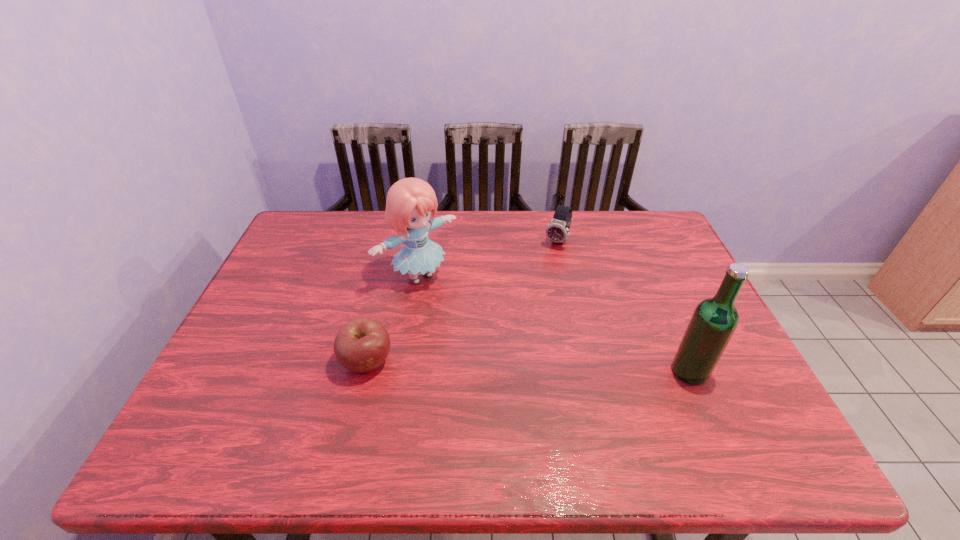
At what (x,y) coordinates should I click in order to perform the action: click on free location located 0.140m on the front-facing side of the second farthest object. Please return your answer as a coordinate pair (x, y). Looking at the image, I should click on (472, 321).

Find the location of `vacant area situated on the front-facing side of the second farthest object`. vacant area situated on the front-facing side of the second farthest object is located at coordinates (543, 383).

Find the location of a particular element. Image resolution: width=960 pixels, height=540 pixels. free spot located 0.170m on the front-facing side of the second farthest object is located at coordinates (480, 327).

This screenshot has height=540, width=960. I want to click on object located at the far edge, so click(x=557, y=231).

This screenshot has width=960, height=540. I want to click on object situated at the near edge, so click(714, 321).

Where is `object that is at the right edge`? The height and width of the screenshot is (540, 960). object that is at the right edge is located at coordinates (714, 321).

You are a GUI agent. You are given a task and a screenshot of the screen. Output one action in this format:
    pyautogui.click(x=<x>, y=<y>)
    Task: Click on the object that is at the near right corner
    This screenshot has height=540, width=960.
    Given the screenshot: What is the action you would take?
    pyautogui.click(x=714, y=321)

This screenshot has width=960, height=540. In order to click on free point at the far edge in this screenshot , I will do `click(471, 211)`.

Find the location of a particular element. This screenshot has height=540, width=960. vacant region at the near edge is located at coordinates (604, 388).

In order to click on vacant point at the left edge in this screenshot , I will do `click(289, 262)`.